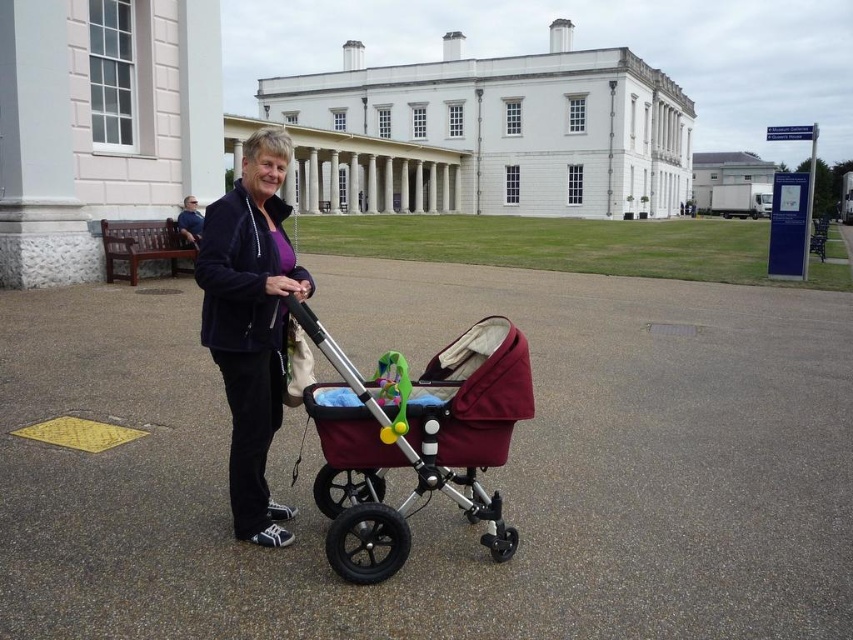
Between point (276, 388) and point (198, 241), which one is positioned in front?

Positioned in front is point (276, 388).

The height and width of the screenshot is (640, 853). What are the coordinates of `velvet purple jacket at center` in the screenshot? It's located at (251, 323).

From the picture: Between maroon fabric baby carriage at center and blue fabric shirt at upper center, which one appears on the right side from the viewer's perspective?

From the viewer's perspective, maroon fabric baby carriage at center appears more on the right side.

Is maroon fabric baby carriage at center thinner than blue fabric shirt at upper center?

In fact, maroon fabric baby carriage at center might be wider than blue fabric shirt at upper center.

Who is more forward, (x=350, y=435) or (x=184, y=211)?

Point (x=350, y=435) is more forward.

Locate an element on the screen. The height and width of the screenshot is (640, 853). maroon fabric baby carriage at center is located at coordinates (415, 440).

Is point (502, 420) more distant than point (236, 392)?

No, (502, 420) is closer to viewer.

Between maroon fabric baby carriage at center and velvet purple jacket at center, which one is positioned higher?

velvet purple jacket at center is higher up.

Who is more forward, (386, 464) or (239, 529)?

Point (386, 464) is in front.

Where is `maroon fabric baby carriage at center`? The width and height of the screenshot is (853, 640). maroon fabric baby carriage at center is located at coordinates (415, 440).